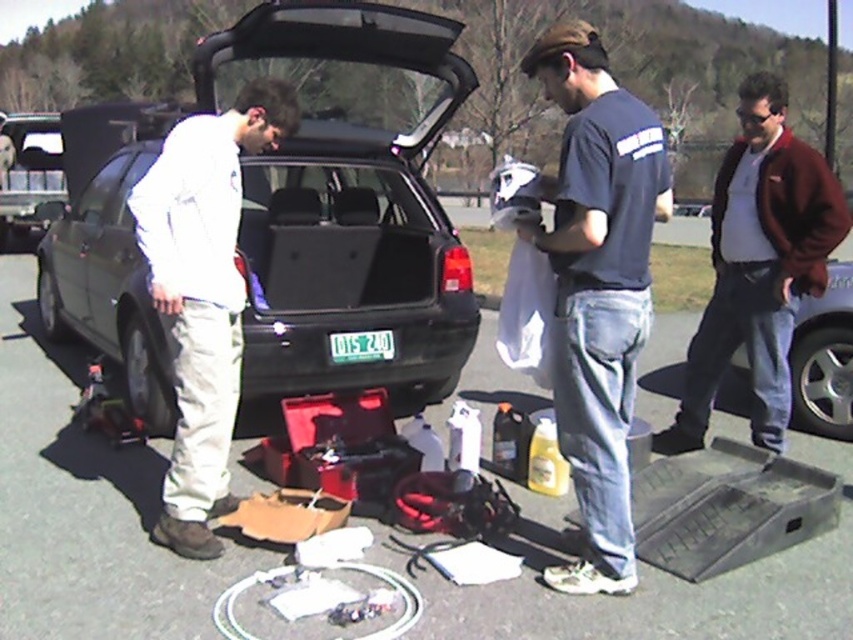
Question: Based on their relative distances, which object is nearer to the dark blue t-shirt at center?

Choices:
 (A) matte black car at center
 (B) metallic silver car at right
 (C) white matte jacket at left

Answer: (C)

Question: Is white matte jacket at left below metallic silver car at right?

Choices:
 (A) yes
 (B) no

Answer: (B)

Question: Estimate the real-world distances between objects in this image. Which object is closer to the metallic silver car at right?

Choices:
 (A) matte black car at center
 (B) white matte jacket at left
 (C) dark blue t-shirt at center
 (D) maroon woolen jacket at right

Answer: (D)

Question: Among these objects, which one is farthest from the camera?

Choices:
 (A) matte black car at center
 (B) metallic silver car at right

Answer: (A)

Question: In this image, where is white matte jacket at left located relative to metallic silver car at right?

Choices:
 (A) right
 (B) left

Answer: (B)

Question: Does dark blue t-shirt at center lie in front of white matte jacket at left?

Choices:
 (A) yes
 (B) no

Answer: (A)